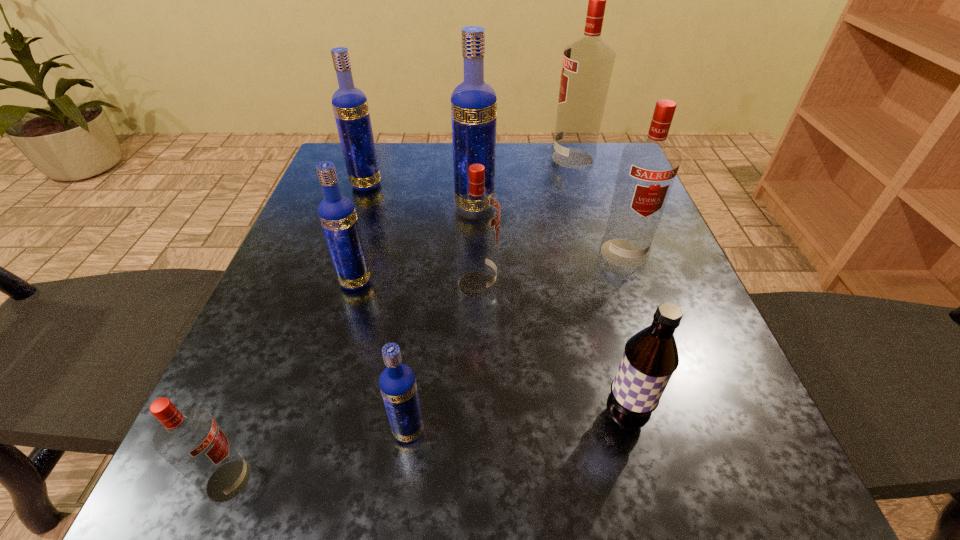
Locate an element on the screen. This screenshot has height=540, width=960. free region located on the left of the farthest blue vodka is located at coordinates (317, 185).

Where is `free location located on the front label of the fourth farthest object`? The height and width of the screenshot is (540, 960). free location located on the front label of the fourth farthest object is located at coordinates (672, 390).

Identify the location of vacant space located 0.360m on the front of the third biggest blue vodka. This screenshot has width=960, height=540. (290, 509).

Find the location of a particular element. The height and width of the screenshot is (540, 960). vacant point located on the front label of the third red vodka from right to left is located at coordinates 636,284.

You are a GUI agent. You are given a task and a screenshot of the screen. Output one action in this format:
    pyautogui.click(x=<x>, y=<y>)
    Task: Click on the vacant area located on the right of the root beer
    The height and width of the screenshot is (540, 960).
    Given the screenshot: What is the action you would take?
    pyautogui.click(x=704, y=417)

The width and height of the screenshot is (960, 540). In order to click on free point located on the left of the second nearest vodka in this screenshot , I will do `click(253, 430)`.

The height and width of the screenshot is (540, 960). In order to click on vacant space located 0.230m on the front label of the smallest red vodka in this screenshot , I will do `click(435, 481)`.

The height and width of the screenshot is (540, 960). Find the location of `object located in the near edge section of the desktop`. object located in the near edge section of the desktop is located at coordinates (189, 439).

I want to click on root beer at the right edge, so click(650, 358).

Where is `object positioned at the far left corner`? The height and width of the screenshot is (540, 960). object positioned at the far left corner is located at coordinates (350, 106).